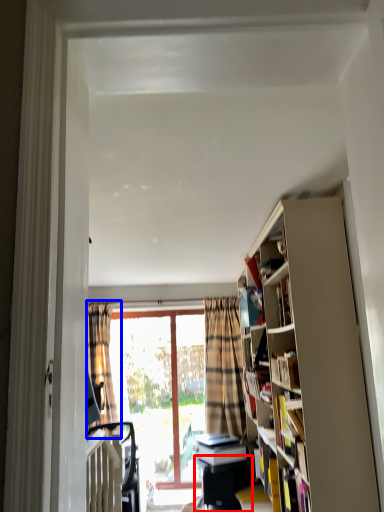
Question: Which of the following is the farthest to the observer, table (highlighted by a red box) or curtain (highlighted by a blue box)?

Choices:
 (A) table
 (B) curtain

Answer: (B)